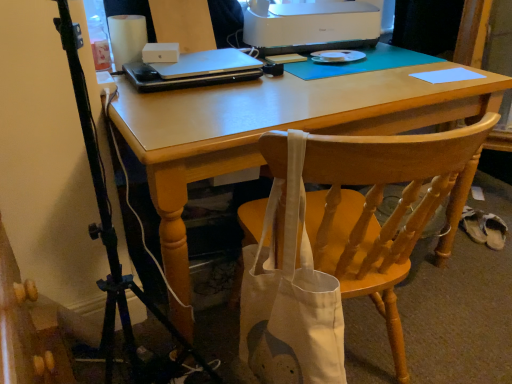
The height and width of the screenshot is (384, 512). In order to click on sleek silver laptop at center in this screenshot , I will do `click(195, 70)`.

What do you see at coordinates (494, 231) in the screenshot? I see `white fabric shoe at lower right` at bounding box center [494, 231].

Where is `light blue paper at upper right`? The height and width of the screenshot is (384, 512). light blue paper at upper right is located at coordinates (447, 75).

Where is `white plastic printer at upper center`? The image size is (512, 384). white plastic printer at upper center is located at coordinates (310, 26).

What are the coordinates of `sleek silver laptop at center` in the screenshot? It's located at pos(195,70).

Between sleek silver laptop at center and white fabric shoe at lower right, which one has smaller size?

white fabric shoe at lower right.

Considering the sizes of objects sleek silver laptop at center and white fabric shoe at lower right in the image provided, who is thinner, sleek silver laptop at center or white fabric shoe at lower right?

sleek silver laptop at center.

Does sleek silver laptop at center come in front of white fabric shoe at lower right?

Yes, it is.

Can you confirm if sleek silver laptop at center is positioned to the right of white fabric shoe at lower right?

No, sleek silver laptop at center is not to the right of white fabric shoe at lower right.

From the image's perspective, is white fabric shoe at lower right above or below matte wooden desk at center?

Based on their image positions, white fabric shoe at lower right is located beneath matte wooden desk at center.

In the scene shown: How many degrees apart are the facing directions of white fabric shoe at lower right and matte wooden desk at center?

There is a 47.4-degree angle between the facing directions of white fabric shoe at lower right and matte wooden desk at center.

Does white fabric shoe at lower right have a lesser height compared to matte wooden desk at center?

Yes.

Is white fabric shoe at lower right facing away from matte wooden desk at center?

That's not correct — white fabric shoe at lower right is not looking away from matte wooden desk at center.

From the image's perspective, between white plastic printer at upper center and sleek silver laptop at center, who is located below?

sleek silver laptop at center, from the image's perspective.

Is point (266, 25) farther from camera compared to point (132, 76)?

Yes, it is.

How different are the orientations of white plastic printer at upper center and sleek silver laptop at center in degrees?

The angle between the facing direction of white plastic printer at upper center and the facing direction of sleek silver laptop at center is 4.73 degrees.

Is white plastic printer at upper center looking in the opposite direction of sleek silver laptop at center?

That's not correct — white plastic printer at upper center is not looking away from sleek silver laptop at center.

Can you tell me how much wooden chair at center and white plastic printer at upper center differ in facing direction?

They differ by 68.4 degrees in their facing directions.

From a real-world perspective, between wooden chair at center and white plastic printer at upper center, who is vertically higher?

white plastic printer at upper center is physically above.

Is wooden chair at center not near white plastic printer at upper center?

No, wooden chair at center is not far from white plastic printer at upper center.

Which object is more forward, wooden chair at center or white plastic printer at upper center?

wooden chair at center is more forward.

Which object is further away from the camera taking this photo, white plastic printer at upper center or matte wooden desk at center?

white plastic printer at upper center.

Is white plastic printer at upper center oriented towards matte wooden desk at center?

No.

Does white plastic printer at upper center appear on the left side of matte wooden desk at center?

Incorrect, white plastic printer at upper center is not on the left side of matte wooden desk at center.

From a real-world perspective, who is located higher, light blue paper at upper right or matte wooden desk at center?

light blue paper at upper right is physically above.

This screenshot has height=384, width=512. What are the coordinates of `computer desk lying below the light blue paper at upper right (from the image's perspective)` in the screenshot? It's located at (x=274, y=128).

Is light blue paper at upper right aimed at matte wooden desk at center?

Yes, light blue paper at upper right is turned towards matte wooden desk at center.

Is light blue paper at upper right located within wooden chair at center?

That's incorrect, light blue paper at upper right is not inside wooden chair at center.

Is wooden chair at center facing towards light blue paper at upper right?

No, wooden chair at center is not facing towards light blue paper at upper right.

Is wooden chair at center bigger or smaller than light blue paper at upper right?

Considering their sizes, wooden chair at center takes up more space than light blue paper at upper right.

Which object is further away from the camera taking this photo, wooden chair at center or light blue paper at upper right?

light blue paper at upper right is more distant.

At what (x,y) coordinates should I click in order to perform the action: click on walking shoe behind the sleek silver laptop at center. Please return your answer as a coordinate pair (x, y). Looking at the image, I should click on (494, 231).

Where is `walking shoe on the right of matte wooden desk at center`? walking shoe on the right of matte wooden desk at center is located at coordinates (494, 231).

Based on their spatial positions, is matte wooden desk at center or wooden chair at center further from light blue paper at upper right?

Based on the image, wooden chair at center appears to be further to light blue paper at upper right.

Estimate the real-world distances between objects in this image. Which object is closer to light blue paper at upper right, wooden chair at center or white fabric shoe at lower right?

wooden chair at center.

From the image, which object appears to be nearer to wooden chair at center, light blue paper at upper right or matte wooden desk at center?

matte wooden desk at center.

Considering their positions, is sleek silver laptop at center positioned further to white fabric shoe at lower right than white plastic printer at upper center?

sleek silver laptop at center is positioned further to the anchor white fabric shoe at lower right.

Estimate the real-world distances between objects in this image. Which object is further from sleek silver laptop at center, matte wooden desk at center or light blue paper at upper right?

light blue paper at upper right.

Based on their spatial positions, is sleek silver laptop at center or white plastic printer at upper center further from light blue paper at upper right?

sleek silver laptop at center lies further to light blue paper at upper right than the other object.

Estimate the real-world distances between objects in this image. Which object is further from wooden chair at center, sleek silver laptop at center or white plastic printer at upper center?

white plastic printer at upper center is positioned further to the anchor wooden chair at center.

Looking at the image, which one is located closer to white fabric shoe at lower right, light blue paper at upper right or wooden chair at center?

light blue paper at upper right is positioned closer to the anchor white fabric shoe at lower right.

I want to click on computer desk between wooden chair at center and sleek silver laptop at center along the z-axis, so click(274, 128).

The height and width of the screenshot is (384, 512). I want to click on printer between sleek silver laptop at center and white fabric shoe at lower right, so pos(310,26).

At what (x,y) coordinates should I click in order to perform the action: click on chair located between sleek silver laptop at center and white fabric shoe at lower right in the left-right direction. Please return your answer as a coordinate pair (x, y). This screenshot has height=384, width=512. Looking at the image, I should click on (376, 207).

This screenshot has height=384, width=512. In order to click on computer desk between sleek silver laptop at center and light blue paper at upper right from left to right in this screenshot , I will do `click(274, 128)`.